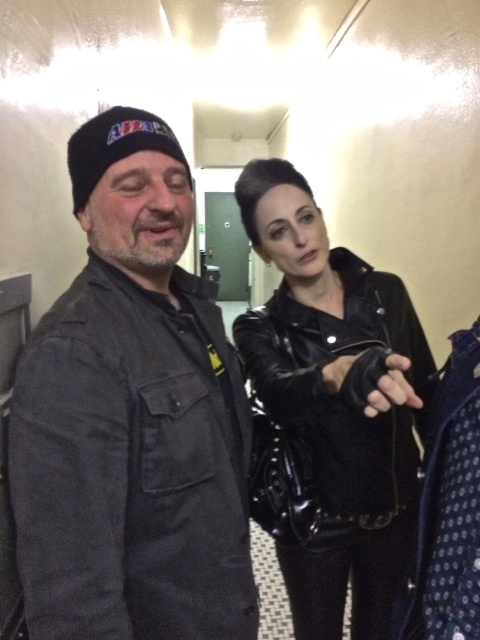
Is dark gray denim jacket at left above black leather jacket at center?

Indeed, dark gray denim jacket at left is positioned over black leather jacket at center.

From the picture: Is the position of dark gray denim jacket at left more distant than that of black leather jacket at center?

Yes, dark gray denim jacket at left is further from the viewer.

Is point (177, 289) less distant than point (284, 253)?

Yes.

The height and width of the screenshot is (640, 480). I want to click on dark gray denim jacket at left, so click(x=132, y=417).